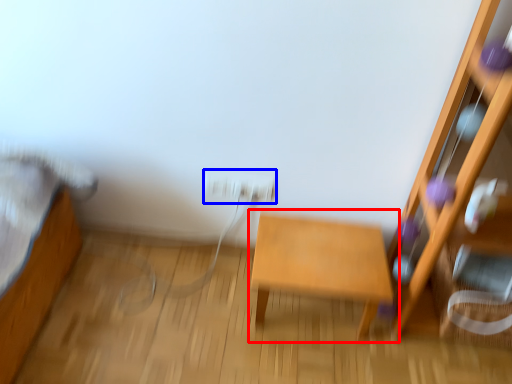
Question: Which point is closer to the camera, table (highlighted by a red box) or electric outlet (highlighted by a blue box)?

Choices:
 (A) table
 (B) electric outlet

Answer: (A)